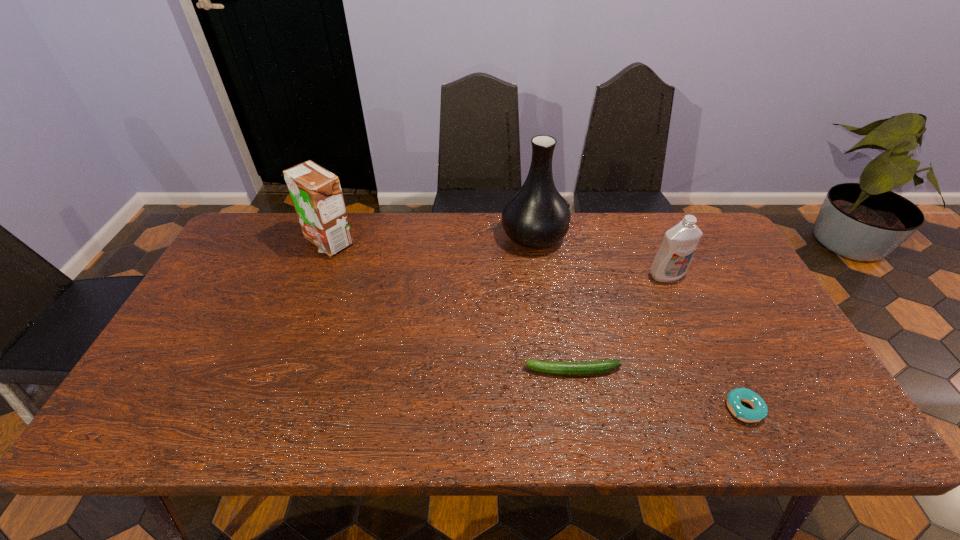
Find the location of a particular element. The image size is (960, 540). free space between the vase and the fourth farthest object is located at coordinates (554, 303).

Image resolution: width=960 pixels, height=540 pixels. What are the coordinates of `free area in between the zucchini and the leftmost object` in the screenshot? It's located at [x=451, y=306].

Locate which object is the third closest to the tallest object. Please provide its 2D coordinates. Your answer should be formatted as a tuple, i.e. [(x, y)], where the tuple contains the x and y coordinates of a point satisfying the conditions above.

[(316, 193)]

You are a GUI agent. You are given a task and a screenshot of the screen. Output one action in this format:
    pyautogui.click(x=<x>, y=<y>)
    Task: Click on the object that is the closest one to the nearest object
    The height and width of the screenshot is (540, 960).
    Given the screenshot: What is the action you would take?
    pyautogui.click(x=594, y=367)

The height and width of the screenshot is (540, 960). Find the location of `free region that satisfies the following two spatial constraints: 1. on the front side of the doughnut; 2. on the left side of the detergent`. free region that satisfies the following two spatial constraints: 1. on the front side of the doughnut; 2. on the left side of the detergent is located at coordinates (725, 408).

Locate an element on the screen. This screenshot has height=540, width=960. free space that satisfies the following two spatial constraints: 1. on the straw side of the detergent; 2. on the right side of the carton is located at coordinates (316, 275).

Identify the location of free region that satisfies the following two spatial constraints: 1. on the straw side of the leftmost object; 2. on the left side of the third shortest object. This screenshot has width=960, height=540. (316, 275).

Locate an element on the screen. free space that satisfies the following two spatial constraints: 1. on the straw side of the detergent; 2. on the right side of the leftmost object is located at coordinates (316, 275).

Where is `vacant space that satisfies the following two spatial constraints: 1. on the front side of the third nearest object; 2. on the left side of the doughnut`? The width and height of the screenshot is (960, 540). vacant space that satisfies the following two spatial constraints: 1. on the front side of the third nearest object; 2. on the left side of the doughnut is located at coordinates (725, 408).

This screenshot has height=540, width=960. I want to click on free location that satisfies the following two spatial constraints: 1. on the front side of the doughnut; 2. on the left side of the detergent, so click(725, 408).